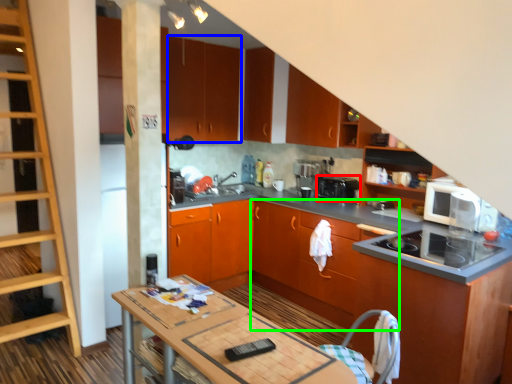
Question: Estimate the real-world distances between objects in this image. Which object is farther from kitchen appliance (highlighted by a red box), cabinetry (highlighted by a blue box) or cabinetry (highlighted by a green box)?

Choices:
 (A) cabinetry
 (B) cabinetry

Answer: (A)